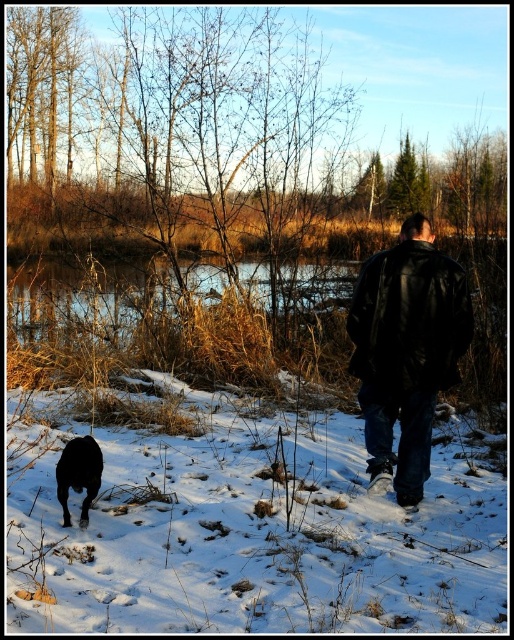
Question: Observing the image, what is the correct spatial positioning of brown grassy creek at center in reference to shiny black dog at lower left?

Choices:
 (A) right
 (B) left

Answer: (B)

Question: Which point is farther to the camera?

Choices:
 (A) brown grassy creek at center
 (B) shiny black dog at lower left

Answer: (A)

Question: Which of these objects is positioned closest to the white fluffy snow at lower center?

Choices:
 (A) shiny black dog at lower left
 (B) black leather jacket at center
 (C) brown grassy creek at center

Answer: (A)

Question: Which object is positioned closest to the black leather jacket at center?

Choices:
 (A) shiny black dog at lower left
 (B) white fluffy snow at lower center
 (C) brown grassy creek at center

Answer: (B)

Question: Does white fluffy snow at lower center have a larger size compared to brown grassy creek at center?

Choices:
 (A) yes
 (B) no

Answer: (A)

Question: Where is black leather jacket at center located in relation to brown grassy creek at center in the image?

Choices:
 (A) left
 (B) right

Answer: (B)